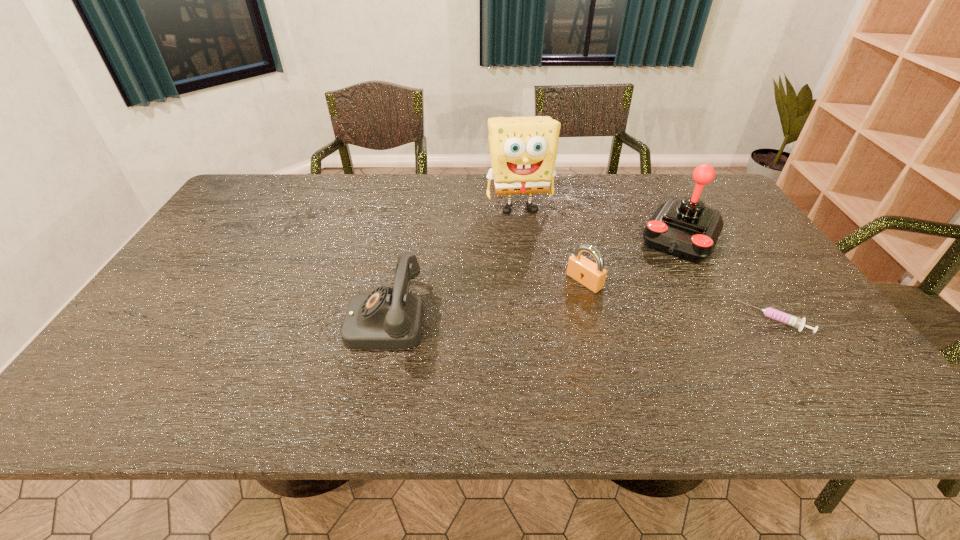
At what (x,y) coordinates should I click in order to perform the action: click on unoccupied position between the shortest object and the joystick. Please return your answer as a coordinate pair (x, y). The image size is (960, 540). Looking at the image, I should click on (728, 278).

Identify which object is the second nearest to the telephone. Please provide its 2D coordinates. Your answer should be formatted as a tuple, i.e. [(x, y)], where the tuple contains the x and y coordinates of a point satisfying the conditions above.

[(591, 275)]

Locate which object is the third closest to the sponge. Please provide its 2D coordinates. Your answer should be formatted as a tuple, i.e. [(x, y)], where the tuple contains the x and y coordinates of a point satisfying the conditions above.

[(388, 318)]

In order to click on free region that satisfies the following two spatial constraints: 1. on the back side of the fourth shortest object; 2. on the right side of the padlock in this screenshot , I will do `click(573, 236)`.

This screenshot has width=960, height=540. In order to click on vacant point that satisfies the following two spatial constraints: 1. on the front side of the sponge; 2. on the left side of the syringe in this screenshot , I will do `click(533, 320)`.